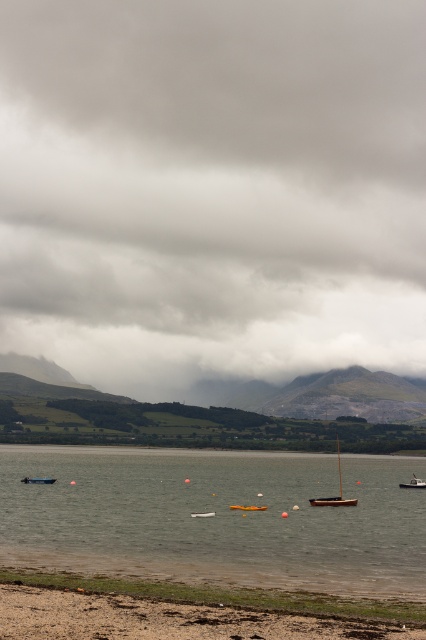
Question: Which object is the closest to the clear water at lower center?

Choices:
 (A) white plastic boat at center
 (B) gray cloudy sky at upper center
 (C) wooden sailboat at center
 (D) brown sandy beach at lower left

Answer: (C)

Question: Does gray cloudy sky at upper center lie behind brown sandy beach at lower left?

Choices:
 (A) no
 (B) yes

Answer: (B)

Question: Does brown sandy beach at lower left have a greater width compared to white plastic kayak at center?

Choices:
 (A) no
 (B) yes

Answer: (B)

Question: Which point is closer to the camera?

Choices:
 (A) (405, 484)
 (B) (336, 435)
 (C) (359, 45)
 (D) (25, 636)

Answer: (D)

Question: Estimate the real-world distances between objects in this image. Which object is farther from the white plastic kayak at center?

Choices:
 (A) clear water at lower center
 (B) white plastic boat at center

Answer: (A)

Question: Where is white plastic boat at center located in relation to blue plastic boat at center in the image?

Choices:
 (A) below
 (B) above

Answer: (A)